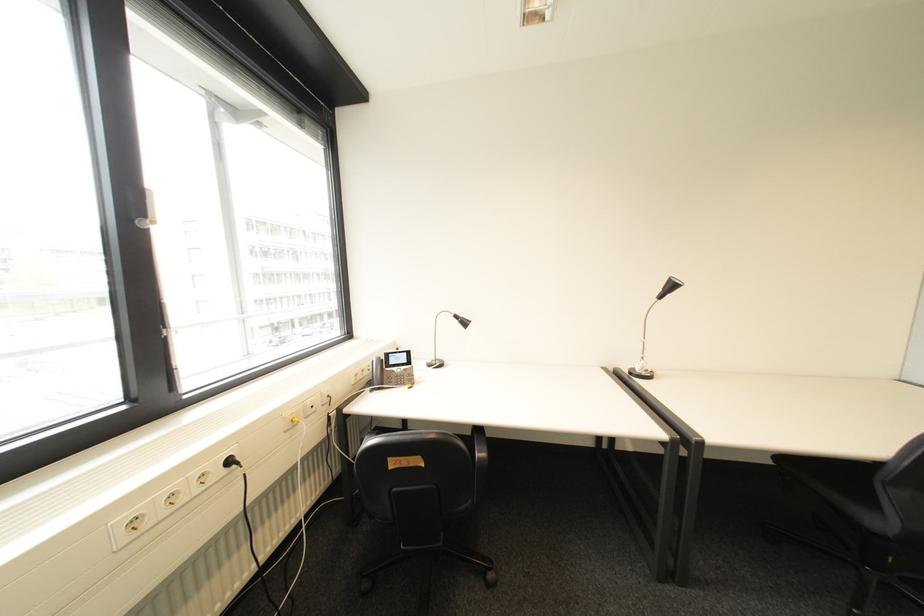
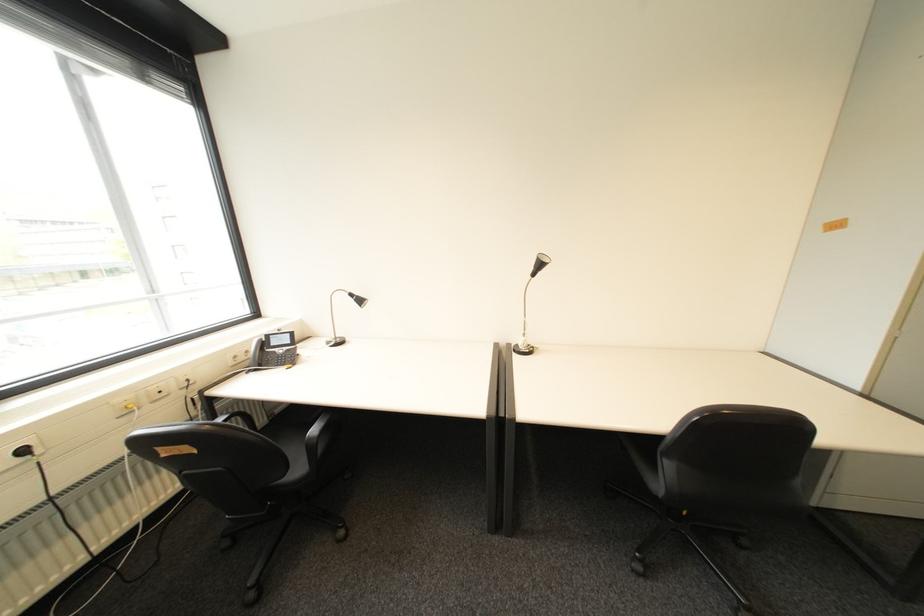
Locate, in the second image, the point that corresponds to pixel 400 363 in the first image.

(283, 345)